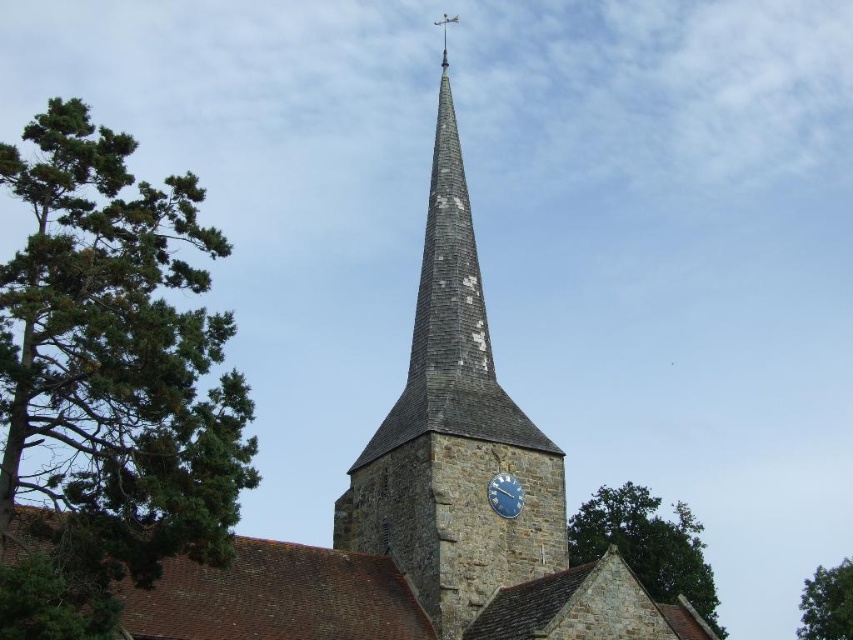
You are standing at the base of the church spire and want to walk to the green leafy tree at upper center. However, there is a green leafy tree at lower right in your path. Can you walk straight ahead without detouring around the tree?

The green leafy tree at lower right is 74.79 feet away from the green leafy tree at upper center. Since the distance between them is significant, you can likely walk straight ahead without detouring around the green leafy tree at lower right, as they are not in the same path.